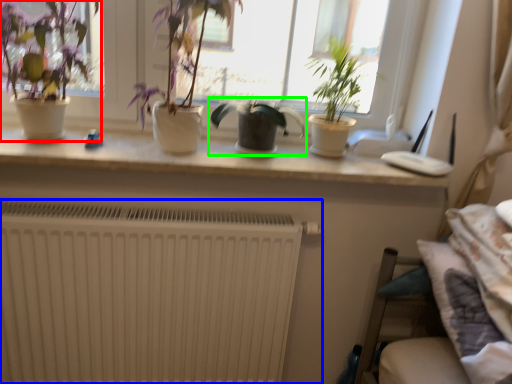
Question: Which object is the closest to the houseplant (highlighted by a red box)? Choose among these: radiator (highlighted by a blue box) or houseplant (highlighted by a green box).

Choices:
 (A) radiator
 (B) houseplant

Answer: (B)